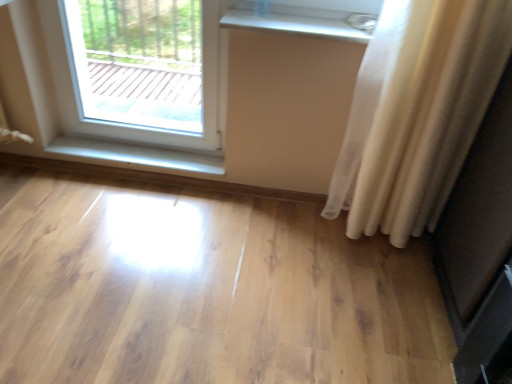
The width and height of the screenshot is (512, 384). In order to click on vacant region under clear glass window at upper left (from a real-world perspective) in this screenshot , I will do `click(140, 149)`.